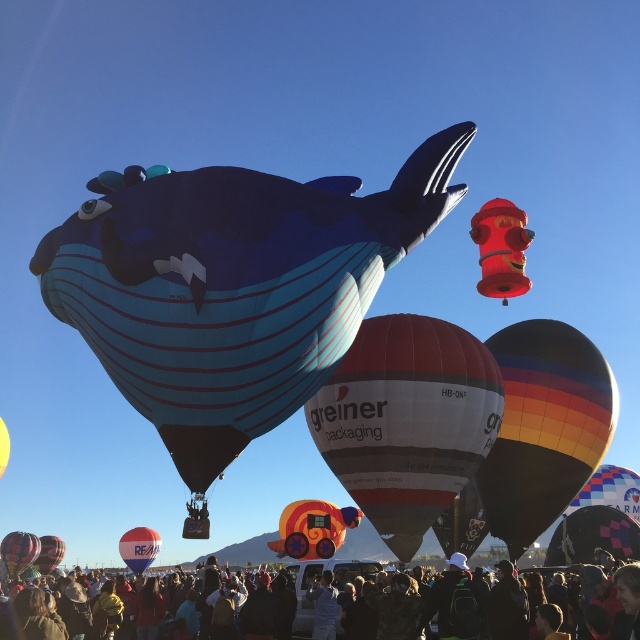
Can you confirm if dark blue fabric crowd at lower center is thinner than red glossy balloon at center?

No.

Is point (461, 600) closer to viewer compared to point (150, 550)?

Yes.

The height and width of the screenshot is (640, 640). In order to click on dark blue fabric crowd at lower center in this screenshot , I will do `click(452, 616)`.

Which of these two, white glossy hot air balloon at center or rainbow striped balloon at center, stands taller?

With more height is white glossy hot air balloon at center.

Is point (406, 512) less distant than point (476, 483)?

That is True.

Locate an element on the screen. The height and width of the screenshot is (640, 640). white glossy hot air balloon at center is located at coordinates (406, 420).

Between point (6, 557) and point (49, 545), which one is positioned behind?

The point (49, 545) is more distant.

Is point (8, 538) farther from camera compared to point (54, 545)?

No, (8, 538) is closer to viewer.

You are a GUI agent. You are given a task and a screenshot of the screen. Output one action in this format:
    pyautogui.click(x=<x>, y=<y>)
    Task: Click on the matte black hot air balloon at lower left
    Image resolution: width=640 pixels, height=640 pixels.
    Given the screenshot: What is the action you would take?
    pos(19,552)